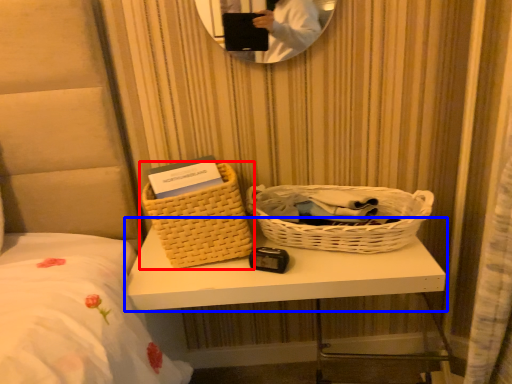
Question: Which of the following is the farthest to the observer, picnic basket (highlighted by a red box) or table (highlighted by a blue box)?

Choices:
 (A) picnic basket
 (B) table

Answer: (A)